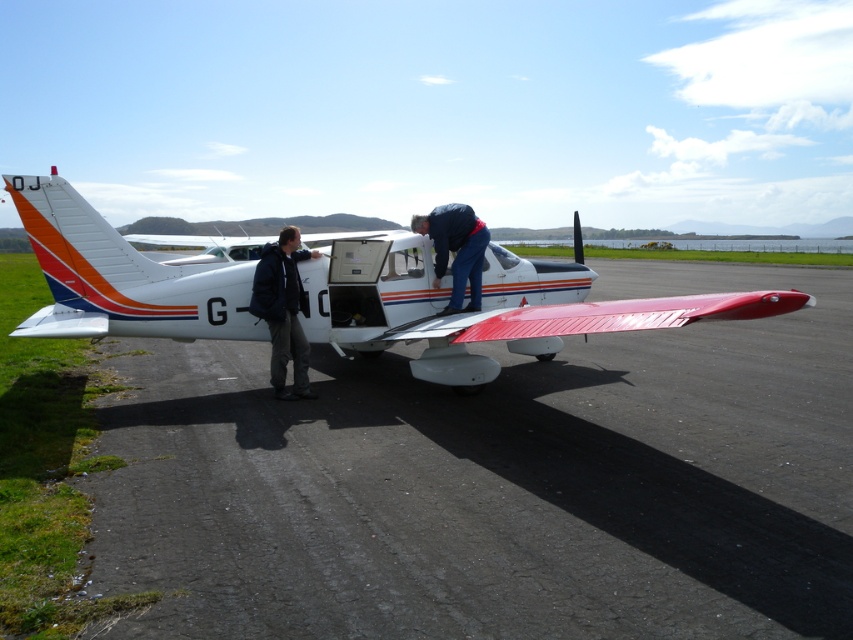
You are standing at the edge of the airfield and see the white glossy airplane at center and the blue jeans at center. Which object is closer to your left side?

The white glossy airplane at center is to the left of blue jeans at center, so it is closer to your left side.

Consider the image. What is the exact location of the smooth asphalt runway at lower center in the image?

The smooth asphalt runway at lower center is located at point coordinates of (496, 483).